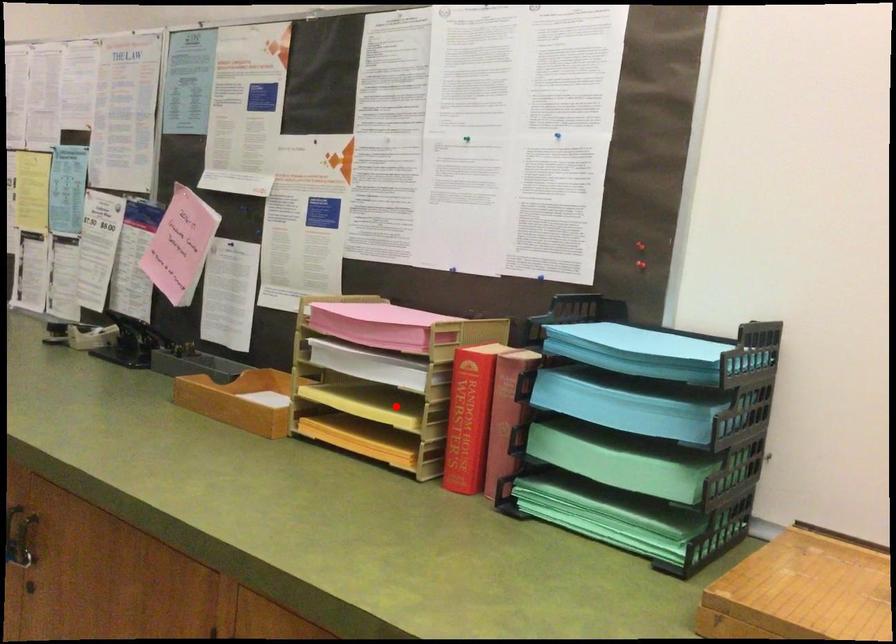
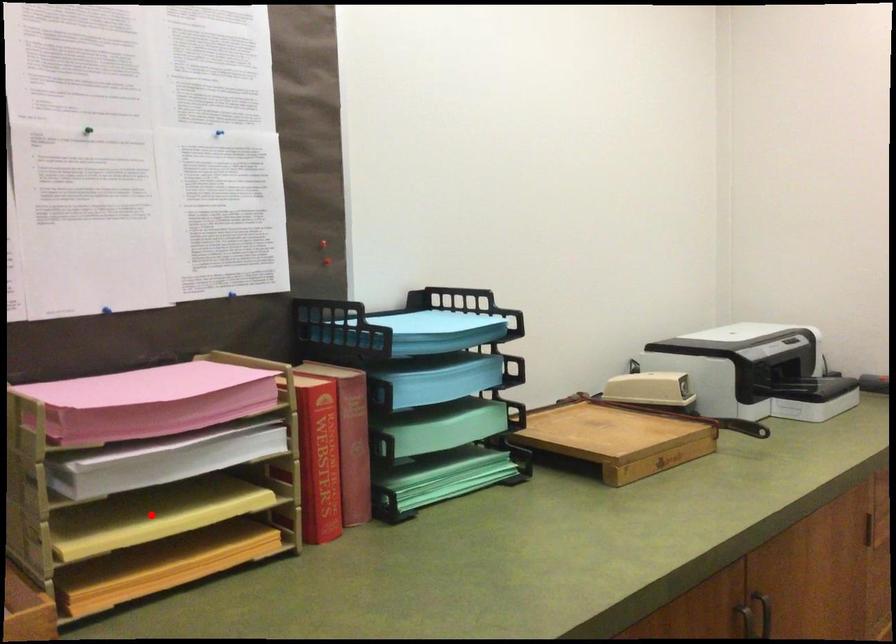
I am providing you with two images of the same scene from different viewpoints. A red point is marked on the first image and another point is marked on the second image. Is the marked point in image1 the same physical position as the marked point in image2?

Yes